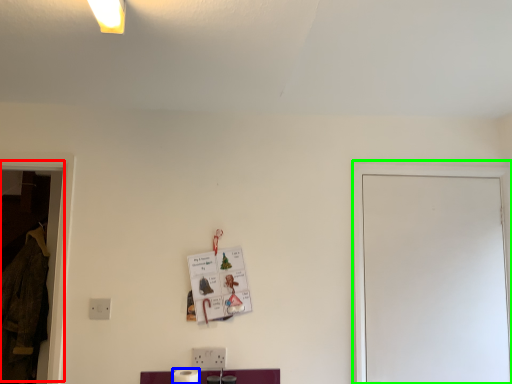
Question: Estimate the real-world distances between objects in this image. Which object is closer to window (highlighted by a red box), toilet paper (highlighted by a blue box) or glass door (highlighted by a green box)?

Choices:
 (A) toilet paper
 (B) glass door

Answer: (A)